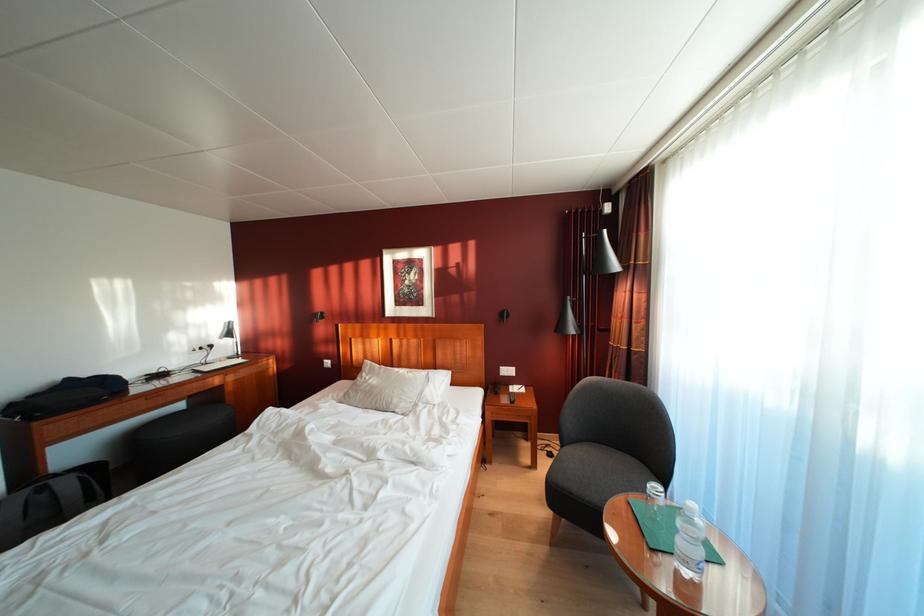
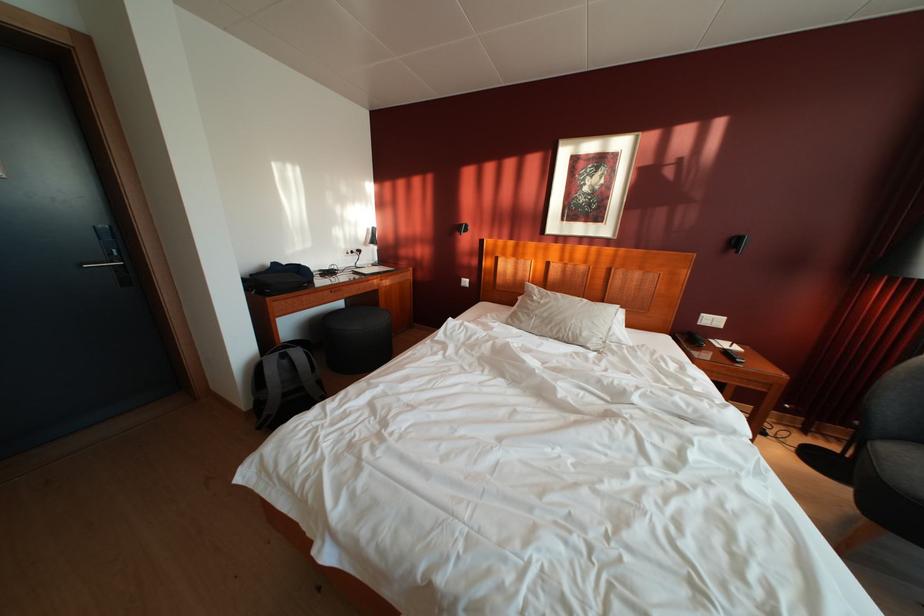
The point at (52, 496) is marked in the first image. Where is the corresponding point in the second image?

(293, 362)